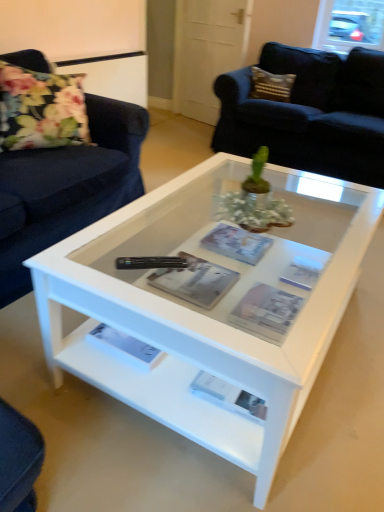
Where is `empty space that is ontop of matte paper magazine at center, the 2th magazine viewed from the front (from a real-world perspective)`? This screenshot has height=512, width=384. empty space that is ontop of matte paper magazine at center, the 2th magazine viewed from the front (from a real-world perspective) is located at coordinates (208, 284).